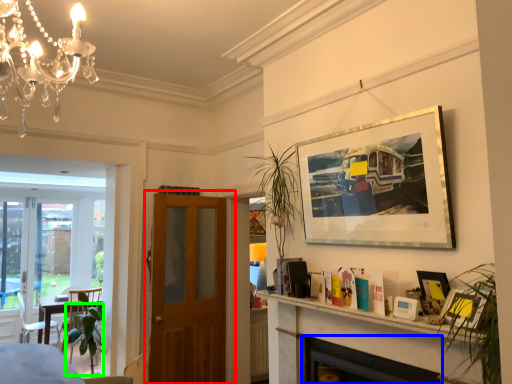
Question: Which object is the farthest from door (highlighted by a red box)? Choose among these: fireplace (highlighted by a blue box) or plant (highlighted by a green box).

Choices:
 (A) fireplace
 (B) plant

Answer: (A)